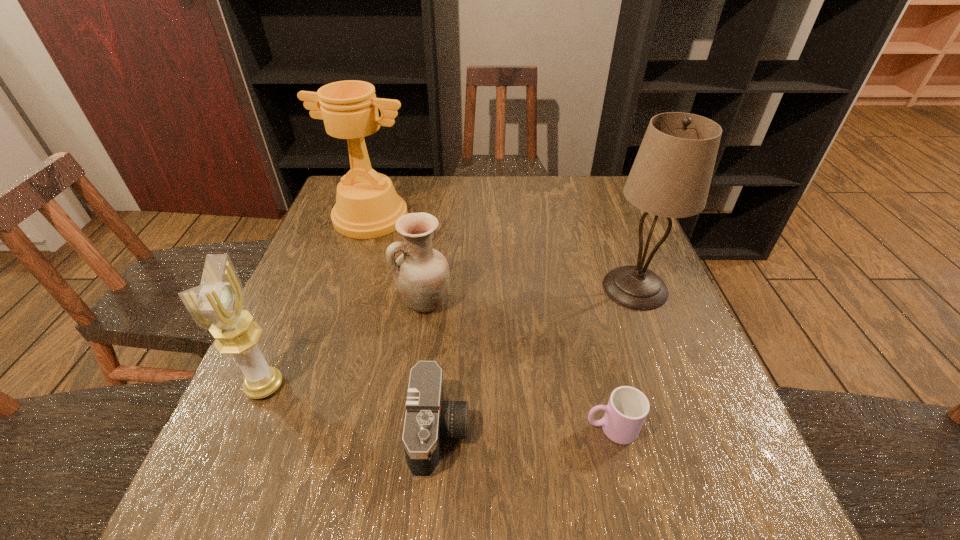
You are a GUI agent. You are given a task and a screenshot of the screen. Output one action in this format:
    pyautogui.click(x=<x>, y=<y>)
    Task: Click on the rightmost object
    Image resolution: width=960 pixels, height=540 pixels.
    Given the screenshot: What is the action you would take?
    pyautogui.click(x=671, y=175)

Find the location of a particular element. the farthest object is located at coordinates (367, 206).

The image size is (960, 540). Find the location of `the farther award`. the farther award is located at coordinates (367, 206).

The width and height of the screenshot is (960, 540). I want to click on the third tallest object, so click(217, 304).

You are a GUI agent. You are given a task and a screenshot of the screen. Output one action in this format:
    pyautogui.click(x=<x>, y=<y>)
    Task: Click on the shorter award
    Image resolution: width=960 pixels, height=540 pixels.
    Given the screenshot: What is the action you would take?
    pyautogui.click(x=217, y=304)

Where is `the fourth tallest object`? Image resolution: width=960 pixels, height=540 pixels. the fourth tallest object is located at coordinates (421, 274).

The image size is (960, 540). What are the coordinates of `camera` in the screenshot? It's located at (428, 419).

Find the location of `the second object from right to left`. the second object from right to left is located at coordinates (627, 408).

Locate an element on the screen. This screenshot has height=540, width=960. cup is located at coordinates (627, 408).

Where is `free space located on the front-facing side of the lampshade`? This screenshot has height=540, width=960. free space located on the front-facing side of the lampshade is located at coordinates (686, 423).